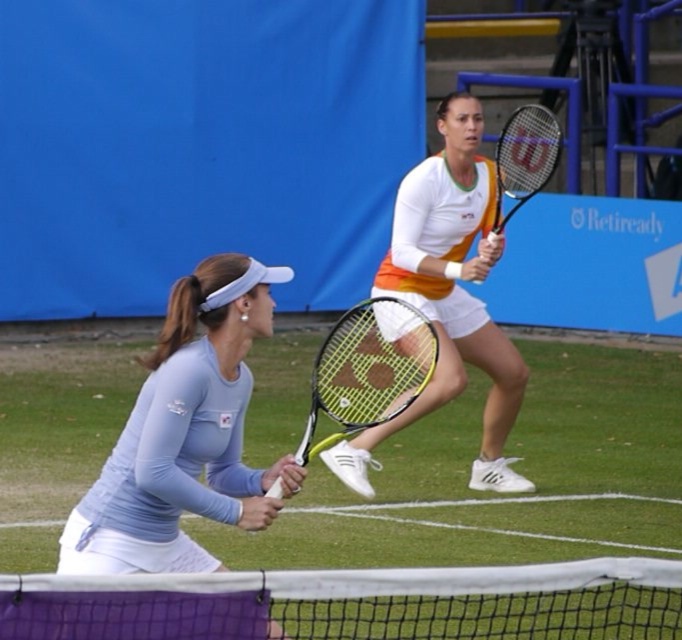
Question: Does matte blue tennis racket at left lie in front of yellow wilson tennis racket at upper center?

Choices:
 (A) yes
 (B) no

Answer: (A)

Question: Is the position of orange fabric tennis outfit at center more distant than that of yellow wilson tennis racket at upper center?

Choices:
 (A) no
 (B) yes

Answer: (A)

Question: Does purple fabric net at center have a larger size compared to yellow wilson tennis racket at upper center?

Choices:
 (A) no
 (B) yes

Answer: (B)

Question: Which point appears closest to the camera in this image?

Choices:
 (A) (53, 596)
 (B) (179, 369)
 (C) (424, 358)

Answer: (A)

Question: Considering the real-world distances, which object is closest to the orange fabric tennis outfit at center?

Choices:
 (A) yellow-green frame racket at center
 (B) yellow wilson tennis racket at upper center
 (C) purple fabric net at center
 (D) matte blue tennis racket at left

Answer: (B)

Question: Which object is the farthest from the yellow-green frame racket at center?

Choices:
 (A) matte blue tennis racket at left
 (B) yellow wilson tennis racket at upper center

Answer: (B)